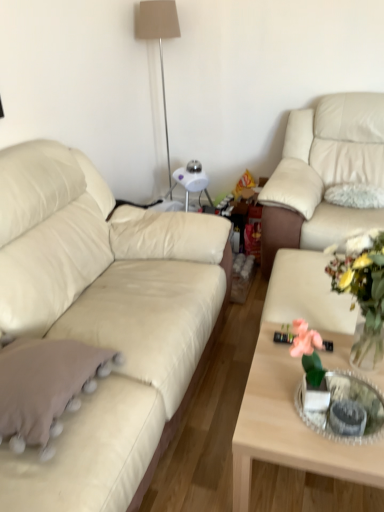
You are a GUI agent. You are given a task and a screenshot of the screen. Output one action in this format:
    pyautogui.click(x=<x>, y=<y>)
    Task: Click on the vacant area on top of clear glass tray at center (from a real-world perspective)
    Image resolution: width=384 pixels, height=512 pixels.
    Given the screenshot: What is the action you would take?
    pyautogui.click(x=351, y=398)